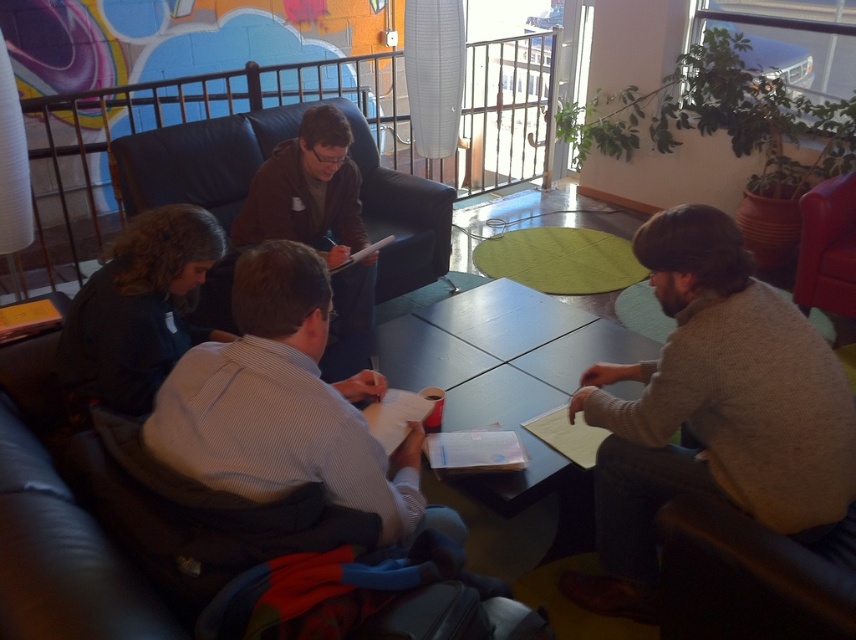
You are standing at the point labeled point (x=620, y=572) and want to move to the point labeled point (x=562, y=497). Which direction should you move to get there?

To move from point (x=620, y=572) to point (x=562, y=497), you should move towards the upper left direction since point (x=562, y=497) is located above and to the left of point (x=620, y=572).

You are a photographer who needs to place a camera exactly 1.6 meters away from the knit sweater at right. Based on the scene description, can you position the camera in the correct spot?

The knit sweater at right and camera are 1.59 meters apart from each other, so yes, you can position the camera exactly 1.6 meters away from the knit sweater at right as the distance is nearly accurate.

You are planning to place a large rectangular desk in your office. You have a smooth dark wood table at center and a matte black armchair at center. Which object has a smaller width that might be more suitable for a narrow space?

The smooth dark wood table at center has a lesser width compared to the matte black armchair at center, making it more suitable for a narrow space.